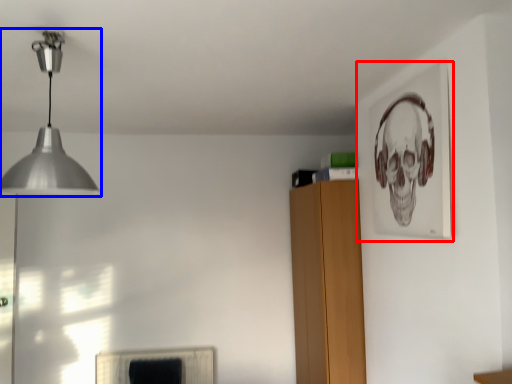
Question: Which of the following is the farthest to the observer, picture frame (highlighted by a red box) or lamp (highlighted by a blue box)?

Choices:
 (A) picture frame
 (B) lamp

Answer: (A)